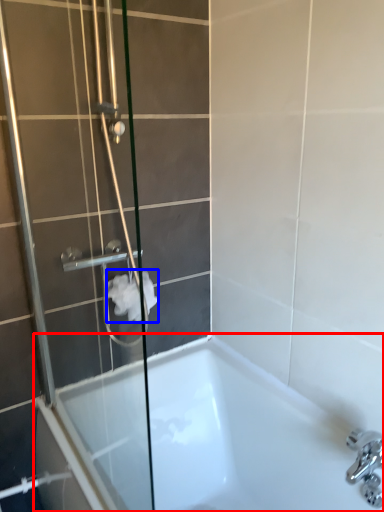
Question: Which of the following is the farthest to the observer, bathtub (highlighted by a red box) or toilet paper (highlighted by a blue box)?

Choices:
 (A) bathtub
 (B) toilet paper

Answer: (B)